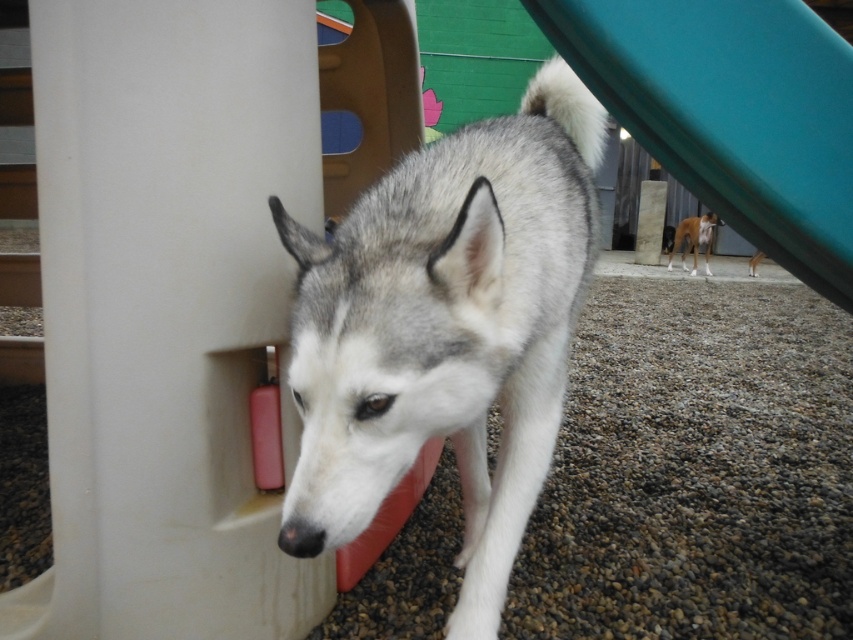
You are a photographer trying to capture a clear photo of the light brown fur at center and the brown fur dog at center. Which one is located higher in the image?

The light brown fur at center is positioned over the brown fur dog at center, so it is higher in the image.

You are a dog trainer observing the image. You notice two dogs in the scene. The first is a Siberian Husky with a mix of white and gray fur at the center, and the second is a smaller dog with light brown fur also at the center. You need to determine if there is enough space between them to safely walk a third dog between them. The third dog requires a minimum of 2 feet of space to pass. Can you confirm if the space between the light brown fur at center and brown fur dog at center is sufficient?

The light brown fur at center and brown fur dog at center are 33.21 inches apart from each other. Since 33.21 inches is equal to 2.7675 feet, which is more than the required 2 feet, there is sufficient space to safely walk a third dog between them.